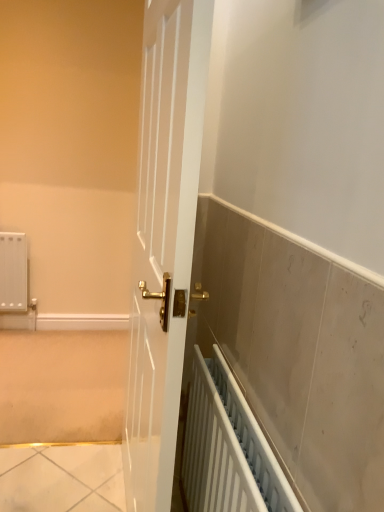
Question: Should I look upward or downward to see white plastic radiator at lower right?

Choices:
 (A) down
 (B) up

Answer: (A)